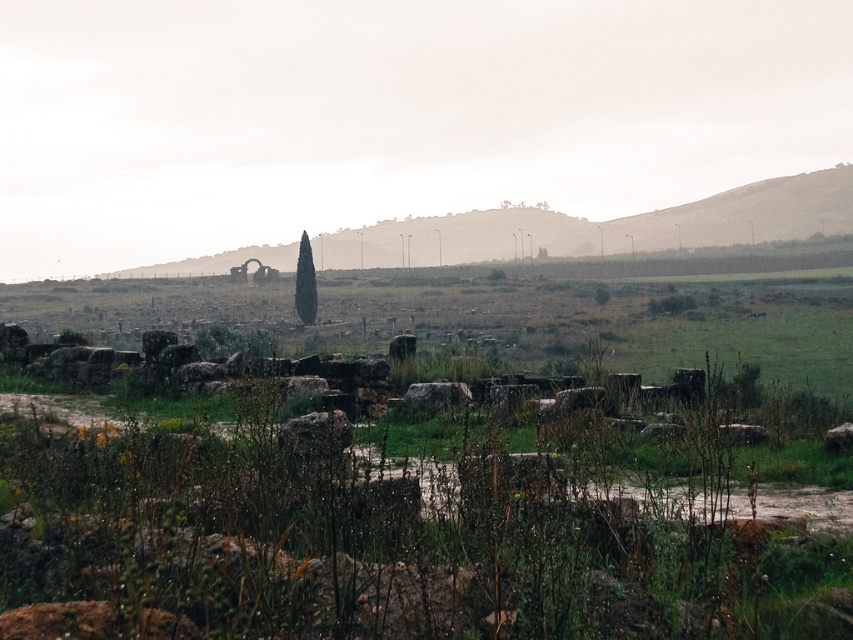
You are a hiker standing at the base of the rustic stone hillside at upper center and want to reach the green leafy tree at center. Which direction should you walk to get closer to the tree?

You should walk away from the rustic stone hillside at upper center towards the green leafy tree at center because the hillside is closer to you than the tree.

You are navigating through the ancient ruins and need to determine which point is closer to you. You see two points marked in the scene, point (698, 241) and point (306, 280). Which point is closer to your current position?

Point (698, 241) is further to the viewer than point (306, 280), so the closer point to your current position is point (306, 280).